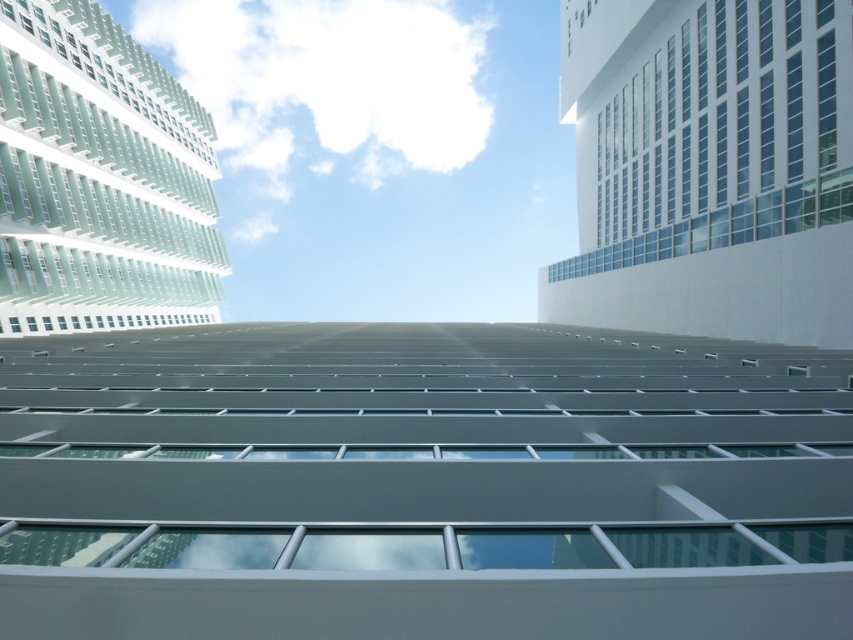
You are standing on the ground floor of the building with the flat roof and horizontal bands of windows. You want to take a photo of the white fluffy cloud at upper center without any obstructions. Is there enough space between you and the cloud for the photo?

The white fluffy cloud at upper center is 111.75 meters away from the viewer, so there is sufficient space to take a photo without obstructions as the distance is large enough.

Looking up at the cluster of modern high rises, you notice two white fluffy clouds in the sky. Which one, the white fluffy cloud at upper center or the white fluffy cloud at center, is larger in size?

The white fluffy cloud at upper center is bigger than the white fluffy cloud at center.